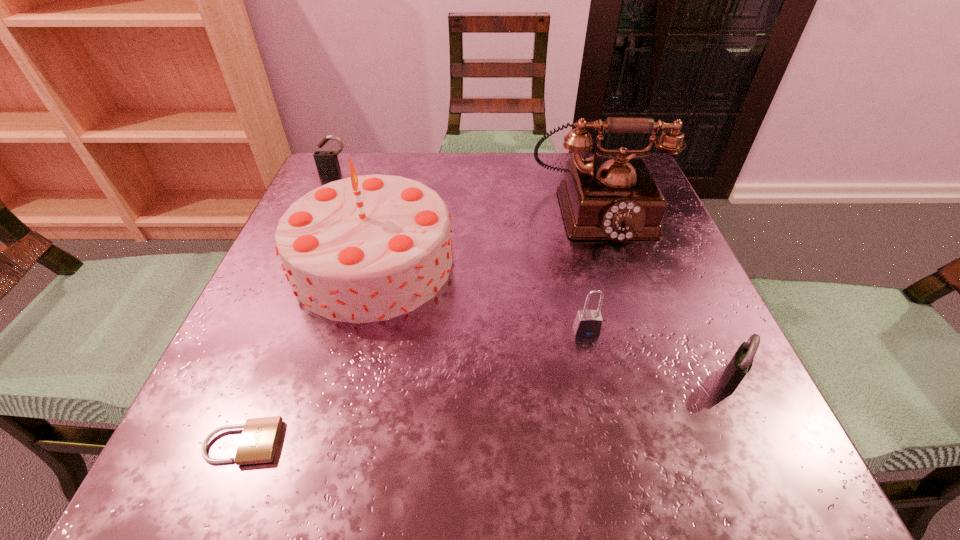
At what (x,y) coordinates should I click in order to perform the action: click on object that is at the far left corner. Please return your answer as a coordinate pair (x, y). The height and width of the screenshot is (540, 960). Looking at the image, I should click on (326, 161).

In order to click on object at the near left corner in this screenshot , I will do `click(259, 439)`.

Find the location of a particular element. This screenshot has height=540, width=960. object located at the far right corner is located at coordinates (617, 199).

Find the location of a particular element. The image size is (960, 540). vacant space at the far edge of the desktop is located at coordinates (527, 193).

Identify the location of vacant space at the near edge of the desktop. Image resolution: width=960 pixels, height=540 pixels. (372, 418).

Where is `vacant space at the left edge of the desktop`? vacant space at the left edge of the desktop is located at coordinates (260, 376).

You are a GUI agent. You are given a task and a screenshot of the screen. Output one action in this format:
    pyautogui.click(x=<x>, y=<y>)
    Task: Click on the free space at the right edge
    This screenshot has width=960, height=540.
    Given the screenshot: What is the action you would take?
    pyautogui.click(x=714, y=354)

In the image, there is a desktop. Where is `free space at the far left corner`? The height and width of the screenshot is (540, 960). free space at the far left corner is located at coordinates (369, 165).

Find the location of a particular element. free area in between the second farthest padlock and the farthest padlock is located at coordinates (461, 251).

Identify the location of free area in between the farthest padlock and the telephone. This screenshot has height=540, width=960. click(x=466, y=191).